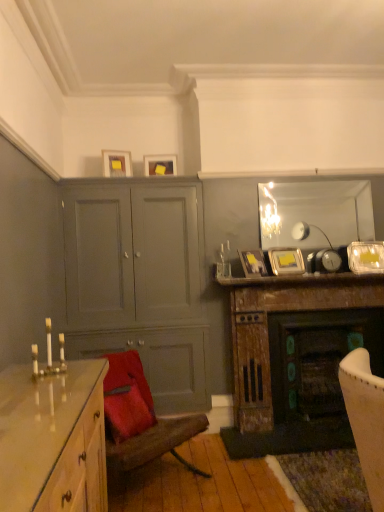
Question: Is the surface of matte black picture frame at upper center, which is the 5th picture frame in top-to-bottom order, in direct contact with matte gray cabinet at center-left?

Choices:
 (A) no
 (B) yes

Answer: (A)

Question: From a real-world perspective, is matte black picture frame at upper center, arranged as the third picture frame when viewed from the left, beneath matte gray cabinet at center-left?

Choices:
 (A) yes
 (B) no

Answer: (B)

Question: Considering the relative positions of matte black picture frame at upper center, arranged as the 3th picture frame when viewed from the right, and matte gray cabinet at center-left in the image provided, is matte black picture frame at upper center, arranged as the 3th picture frame when viewed from the right, to the right of matte gray cabinet at center-left from the viewer's perspective?

Choices:
 (A) yes
 (B) no

Answer: (A)

Question: Considering the relative positions of matte black picture frame at upper center, which is counted as the 1th picture frame, starting from the bottom, and matte gray cabinet at center-left in the image provided, is matte black picture frame at upper center, which is counted as the 1th picture frame, starting from the bottom, to the left of matte gray cabinet at center-left from the viewer's perspective?

Choices:
 (A) yes
 (B) no

Answer: (B)

Question: Is matte black picture frame at upper center, which is the 5th picture frame in top-to-bottom order, taller than matte gray cabinet at center-left?

Choices:
 (A) yes
 (B) no

Answer: (B)

Question: Is matte black picture frame at upper center, which is the 5th picture frame in top-to-bottom order, positioned far away from matte gray cabinet at center-left?

Choices:
 (A) no
 (B) yes

Answer: (A)

Question: From the image's perspective, is matte yellow picture frame at upper center, the second picture frame positioned from the left, beneath clear glass mirror at upper center?

Choices:
 (A) yes
 (B) no

Answer: (B)

Question: Can you confirm if matte yellow picture frame at upper center, placed as the 4th picture frame when sorted from bottom to top, is wider than clear glass mirror at upper center?

Choices:
 (A) no
 (B) yes

Answer: (B)

Question: Is matte yellow picture frame at upper center, placed as the fourth picture frame when sorted from right to left, shorter than clear glass mirror at upper center?

Choices:
 (A) no
 (B) yes

Answer: (B)

Question: Considering the relative sizes of matte yellow picture frame at upper center, which is the second picture frame from top to bottom, and clear glass mirror at upper center in the image provided, is matte yellow picture frame at upper center, which is the second picture frame from top to bottom, smaller than clear glass mirror at upper center?

Choices:
 (A) no
 (B) yes

Answer: (B)

Question: From the image's perspective, does matte yellow picture frame at upper center, which is the second picture frame from top to bottom, appear higher than clear glass mirror at upper center?

Choices:
 (A) yes
 (B) no

Answer: (A)

Question: Can you confirm if matte yellow picture frame at upper center, which is the second picture frame from top to bottom, is taller than clear glass mirror at upper center?

Choices:
 (A) no
 (B) yes

Answer: (A)

Question: Is metallic silver picture frame at upper right, which is counted as the third picture frame, starting from the top, at the right side of matte yellow picture frame at upper center, the 5th picture frame from the bottom?

Choices:
 (A) no
 (B) yes

Answer: (B)